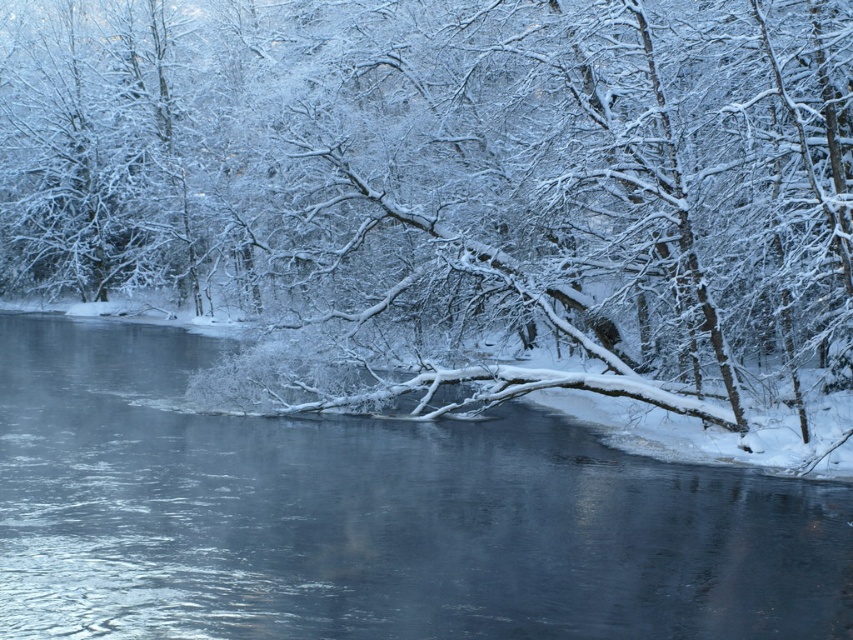
Can you confirm if snow-covered branch at center is taller than smooth ice river at center?

Yes, snow-covered branch at center is taller than smooth ice river at center.

Does snow-covered branch at center appear on the right side of smooth ice river at center?

No, snow-covered branch at center is not to the right of smooth ice river at center.

Does point (134, 84) come farther from viewer compared to point (213, 628)?

Yes, point (134, 84) is behind point (213, 628).

Where is `snow-covered branch at center`? snow-covered branch at center is located at coordinates 450,164.